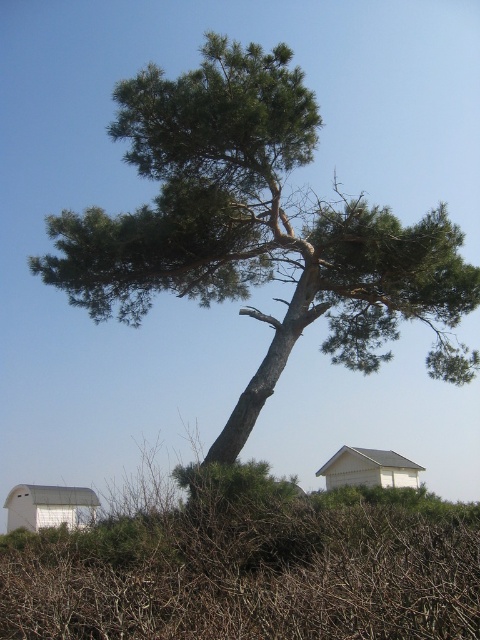
Is green needle-like tree at center thinner than white matte hut at lower left?

No, green needle-like tree at center is not thinner than white matte hut at lower left.

In the scene shown: Who is more distant from viewer, (428, 241) or (10, 492)?

Positioned behind is point (10, 492).

Between point (154, 104) and point (8, 504), which one is positioned behind?

The point (8, 504) is behind.

Where is `green needle-like tree at center`? The width and height of the screenshot is (480, 640). green needle-like tree at center is located at coordinates (257, 228).

Is point (64, 522) more distant than point (367, 481)?

That is False.

Can you confirm if white matte hut at lower left is positioned to the left of white matte house at center?

Indeed, white matte hut at lower left is positioned on the left side of white matte house at center.

Who is more forward, [14,528] or [367,481]?

Point [367,481] is more forward.

Find the location of a particular element. This screenshot has width=480, height=640. white matte hut at lower left is located at coordinates (49, 506).

Which is more to the left, green needle-like tree at center or white matte house at center?

green needle-like tree at center is more to the left.

Is green needle-like tree at center closer to the viewer compared to white matte house at center?

Yes, green needle-like tree at center is in front of white matte house at center.

Image resolution: width=480 pixels, height=640 pixels. What are the coordinates of `green needle-like tree at center` in the screenshot? It's located at (257, 228).